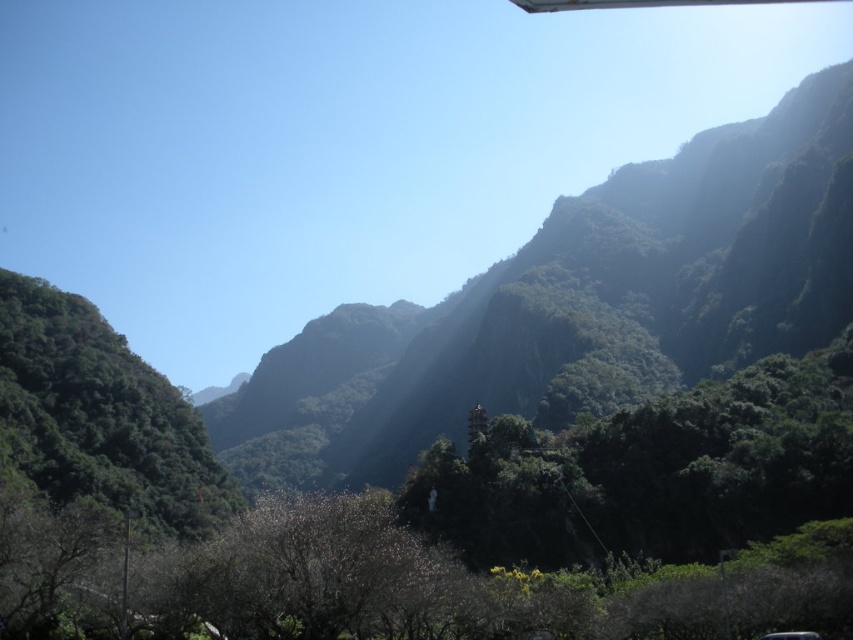
Is green matte tree at center closer to the viewer compared to green leafy tree at left?

No, green matte tree at center is behind green leafy tree at left.

In the scene shown: Between green matte tree at center and green leafy tree at left, which one is positioned higher?

green matte tree at center

Who is more distant from viewer, (519, 456) or (80, 387)?

Positioned behind is point (80, 387).

Find the location of a particular element. green matte tree at center is located at coordinates (648, 472).